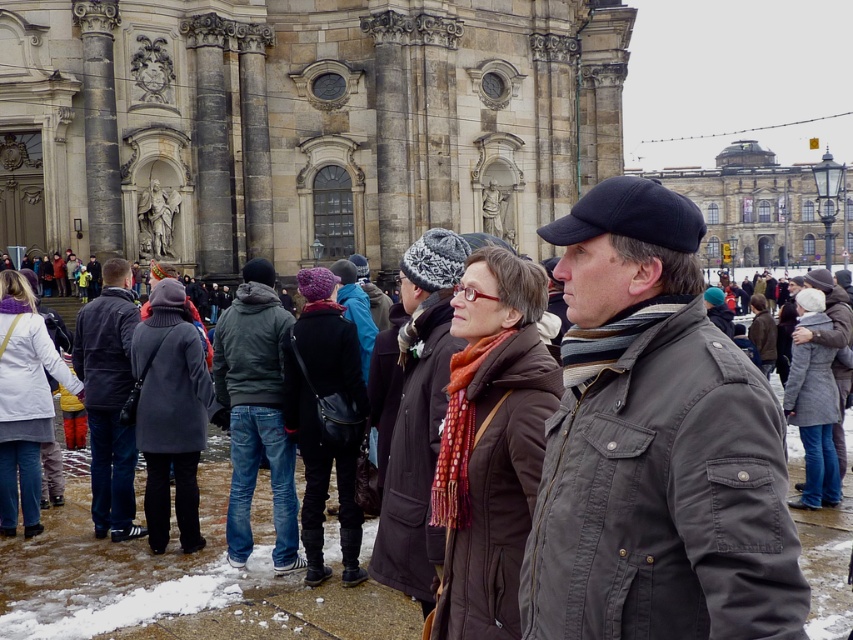
Can you confirm if brown woolen scarf at center is taller than white wool coat at lower left?

Indeed, brown woolen scarf at center has a greater height compared to white wool coat at lower left.

Looking at this image, between brown woolen scarf at center and white wool coat at lower left, which one appears on the right side from the viewer's perspective?

brown woolen scarf at center

Which is in front, point (462, 410) or point (18, 316)?

Point (462, 410) is more forward.

You are a GUI agent. You are given a task and a screenshot of the screen. Output one action in this format:
    pyautogui.click(x=<x>, y=<y>)
    Task: Click on the brown woolen scarf at center
    The image size is (853, 640).
    Given the screenshot: What is the action you would take?
    pyautogui.click(x=491, y=444)

Is brown woolen scarf at center closer to camera compared to brown leather coat at center?

Yes.

Does brown woolen scarf at center appear over brown leather coat at center?

No.

Is point (483, 365) closer to camera compared to point (775, 333)?

That is True.

The height and width of the screenshot is (640, 853). I want to click on brown woolen scarf at center, so click(491, 444).

Which is more to the left, stone textured palace at center or brown woolen scarf at center?

From the viewer's perspective, stone textured palace at center appears more on the left side.

Is stone textured palace at center further to camera compared to brown woolen scarf at center?

Yes, it is behind brown woolen scarf at center.

In order to click on stone textured palace at center in this screenshot , I will do `click(300, 124)`.

Identify the location of stone textured palace at center. (300, 124).